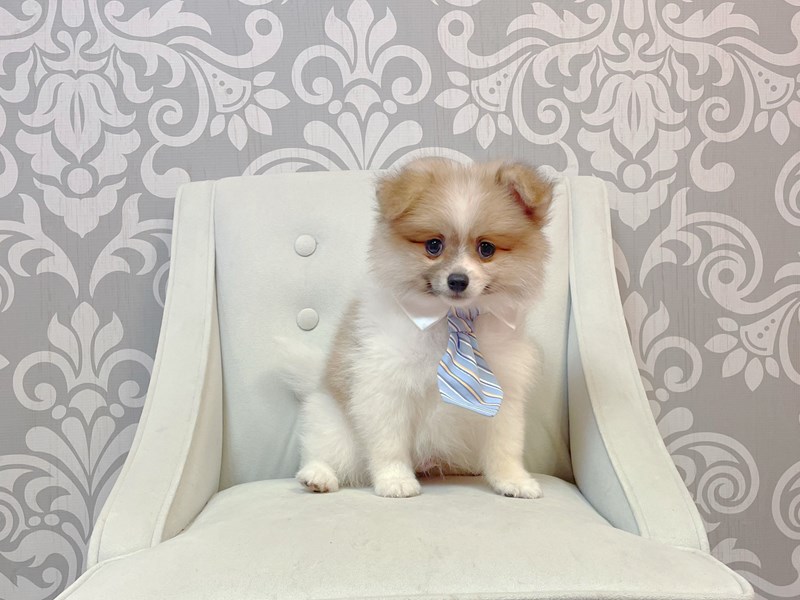
You are a GUI agent. You are given a task and a screenshot of the screen. Output one action in this format:
    pyautogui.click(x=<x>, y=<y>)
    Task: Click on the chair cushion
    The width and height of the screenshot is (800, 600).
    Given the screenshot: What is the action you would take?
    pyautogui.click(x=348, y=554)